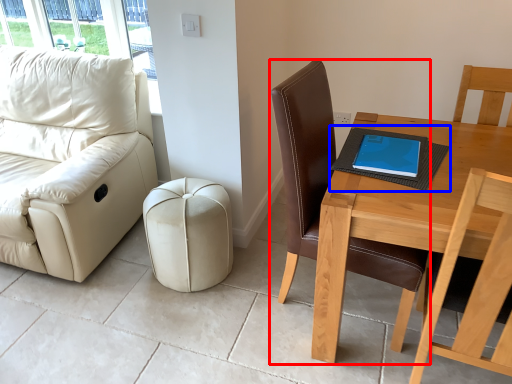
Question: Which object is closer to the camera taking this photo, chair (highlighted by a red box) or notebook (highlighted by a blue box)?

Choices:
 (A) chair
 (B) notebook

Answer: (A)